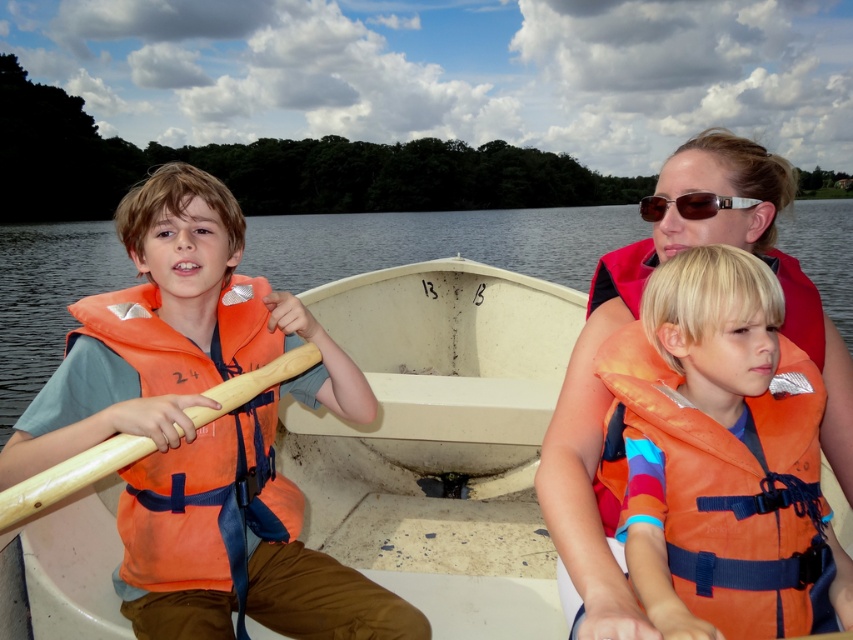
Is orange life vest at center bigger than sunglasses at center?

Yes, orange life vest at center is bigger than sunglasses at center.

What do you see at coordinates (717, 456) in the screenshot? The image size is (853, 640). I see `orange life vest at center` at bounding box center [717, 456].

This screenshot has width=853, height=640. In order to click on orange life vest at center in this screenshot , I will do `click(717, 456)`.

Is white matte boat at center smaller than transparent water at boat center?

Indeed, white matte boat at center has a smaller size compared to transparent water at boat center.

Does white matte boat at center appear under transparent water at boat center?

Yes, white matte boat at center is below transparent water at boat center.

Does point (341, 307) come farther from viewer compared to point (547, 248)?

No, (341, 307) is in front of (547, 248).

Where is `white matte boat at center`? This screenshot has width=853, height=640. white matte boat at center is located at coordinates (440, 440).

Which is behind, point (38, 576) or point (799, 508)?

The point (38, 576) is behind.

Which is above, white matte boat at center or orange life vest at center?

orange life vest at center is above.

Describe the element at coordinates (440, 440) in the screenshot. The width and height of the screenshot is (853, 640). I see `white matte boat at center` at that location.

The image size is (853, 640). What are the coordinates of `white matte boat at center` in the screenshot? It's located at (440, 440).